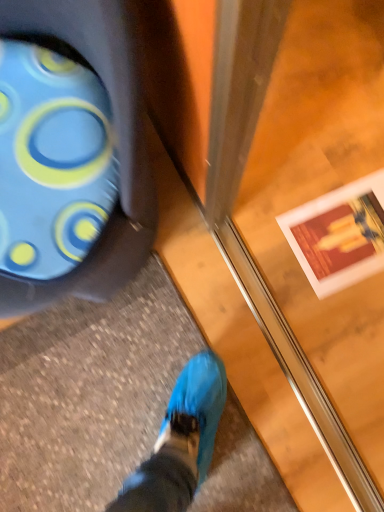
Where is `vacant space behind transparent glass screen door at center`? Image resolution: width=384 pixels, height=512 pixels. vacant space behind transparent glass screen door at center is located at coordinates (298, 155).